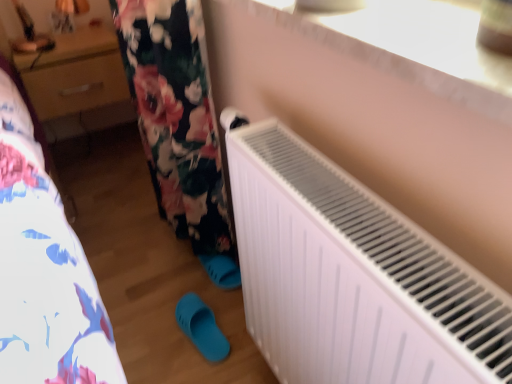
Question: In terms of height, does white plastic radiator at upper right look taller or shorter compared to white matte radiator at lower right?

Choices:
 (A) tall
 (B) short

Answer: (B)

Question: Considering the positions of white plastic radiator at upper right and white matte radiator at lower right in the image, is white plastic radiator at upper right wider or thinner than white matte radiator at lower right?

Choices:
 (A) wide
 (B) thin

Answer: (A)

Question: Estimate the real-world distances between objects in this image. Which object is closer to the matte plastic slipper at lower center?

Choices:
 (A) wooden drawer at upper left
 (B) white matte radiator at lower right
 (C) white plastic radiator at upper right

Answer: (B)

Question: Estimate the real-world distances between objects in this image. Which object is closer to the white plastic radiator at upper right?

Choices:
 (A) wooden drawer at upper left
 (B) matte plastic slipper at lower center
 (C) white matte radiator at lower right

Answer: (C)